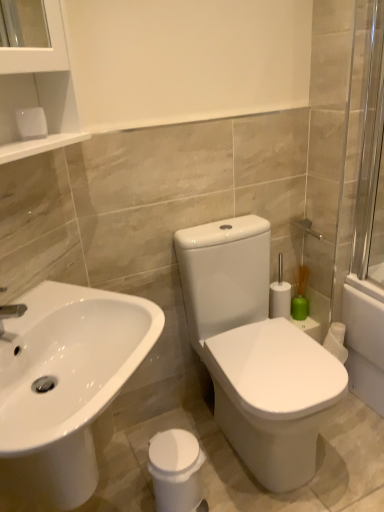
Image resolution: width=384 pixels, height=512 pixels. I want to click on free space behind silver metallic tap at left, so click(43, 306).